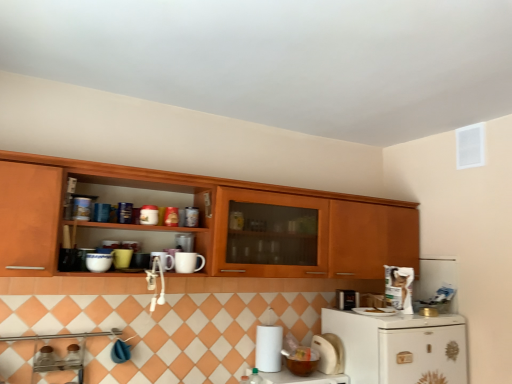
Find the location of a particular element. The width and height of the screenshot is (512, 384). vacant space underneath white plastic plate at lower right, arranged as the first appliance when viewed from the right (from a real-world perspective) is located at coordinates (374, 310).